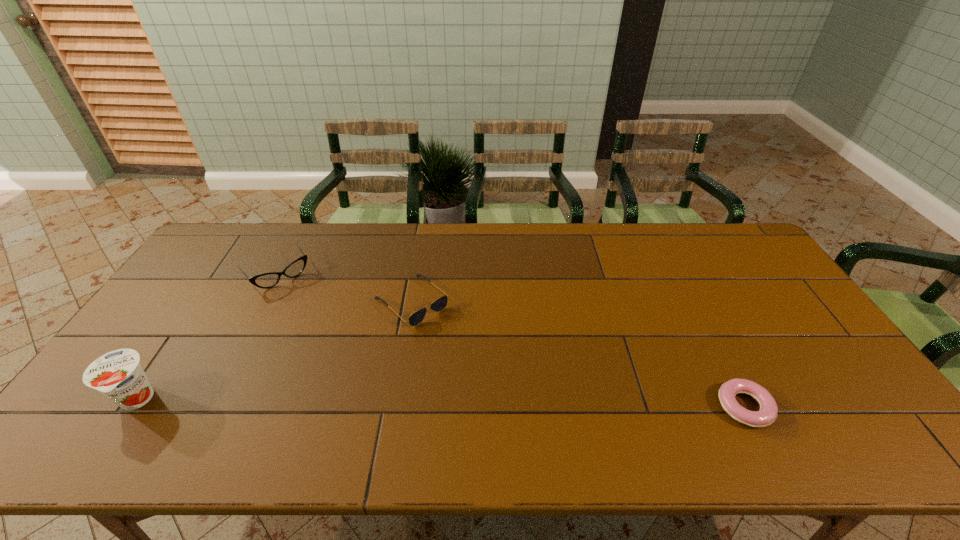
Locate an element on the screen. The height and width of the screenshot is (540, 960). free region that satisfies the following two spatial constraints: 1. on the front side of the doughnut; 2. on the right side of the tallest object is located at coordinates tap(131, 407).